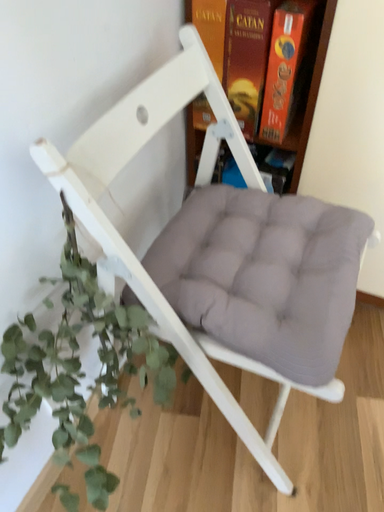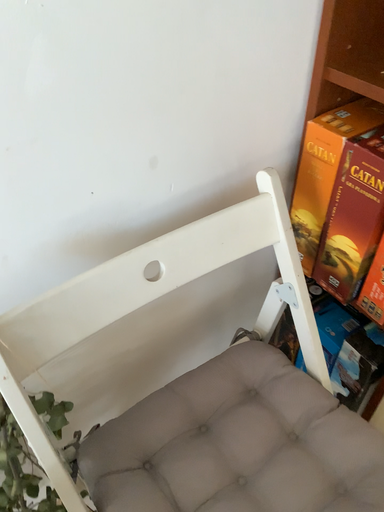
Question: How did the camera likely rotate when shooting the video?

Choices:
 (A) rotated downward
 (B) rotated upward

Answer: (B)